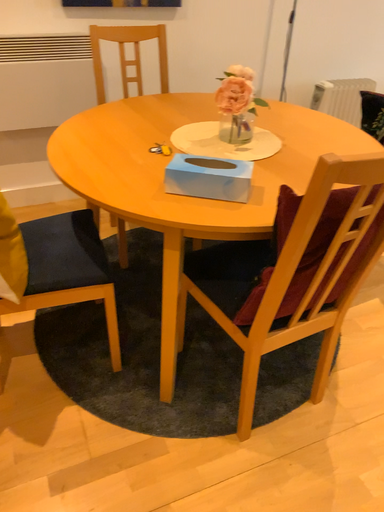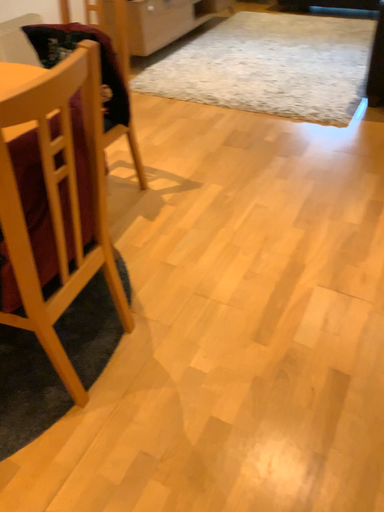
Question: Which way did the camera rotate in the video?

Choices:
 (A) rotated right
 (B) rotated left

Answer: (A)